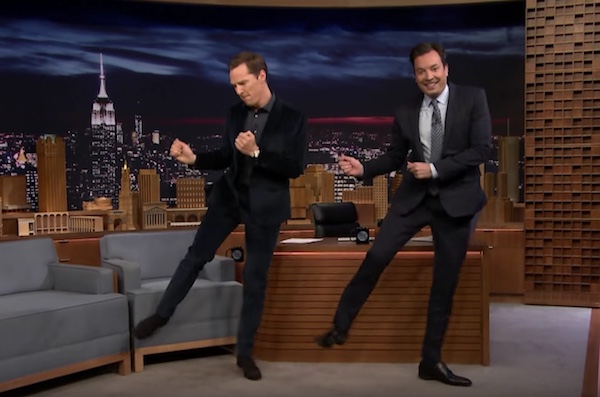
Identify the location of gray couch. The image size is (600, 397). (61, 294).